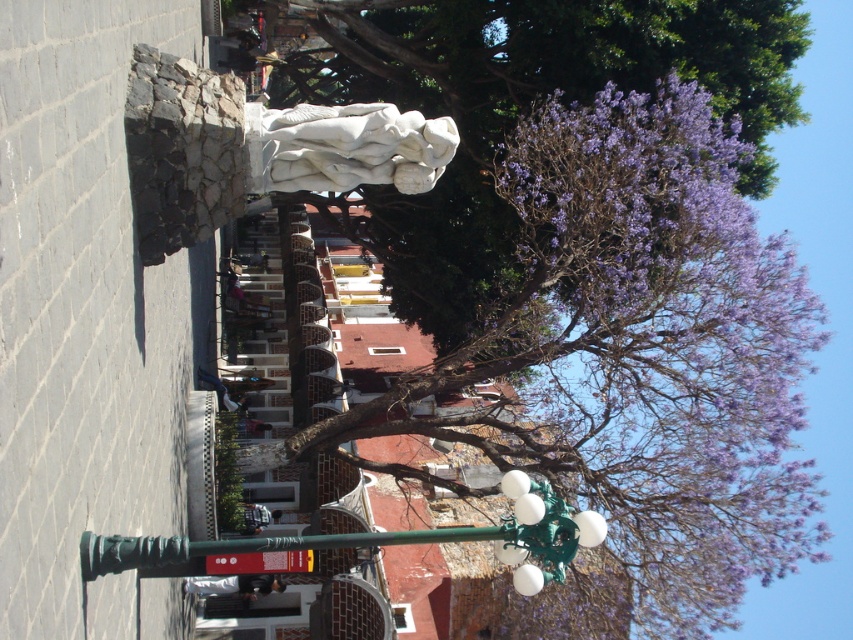
Does purple leafy tree at upper center lie in front of white marble statue at center?

No, it is not.

Locate an element on the screen. This screenshot has width=853, height=640. purple leafy tree at upper center is located at coordinates (602, 243).

Is point (750, 509) more distant than point (384, 112)?

That is True.

Identify the location of purple leafy tree at upper center. This screenshot has height=640, width=853. (602, 243).

Does green painted metal streetlight at lower center appear under white marble statue at center?

Yes, green painted metal streetlight at lower center is below white marble statue at center.

Can you confirm if green painted metal streetlight at lower center is positioned to the right of white marble statue at center?

Yes, green painted metal streetlight at lower center is to the right of white marble statue at center.

Is point (529, 531) farther from camera compared to point (364, 150)?

That is False.

At what (x,y) coordinates should I click in order to perform the action: click on green painted metal streetlight at lower center. Please return your answer as a coordinate pair (x, y). Looking at the image, I should click on (389, 540).

Who is lower down, purple leafy tree at upper center or green painted metal streetlight at lower center?

green painted metal streetlight at lower center is lower down.

Which is more to the right, purple leafy tree at upper center or green painted metal streetlight at lower center?

purple leafy tree at upper center

Between point (793, 557) and point (184, 550), which one is positioned behind?

Positioned behind is point (793, 557).

Where is `purple leafy tree at upper center`? purple leafy tree at upper center is located at coordinates (602, 243).